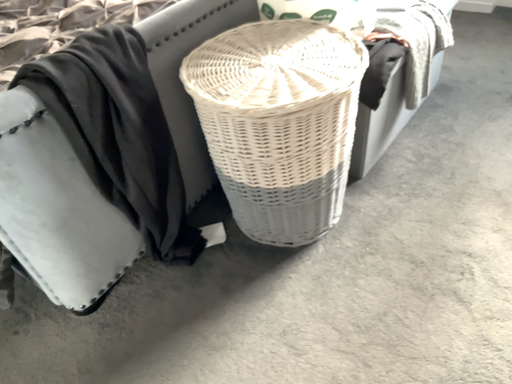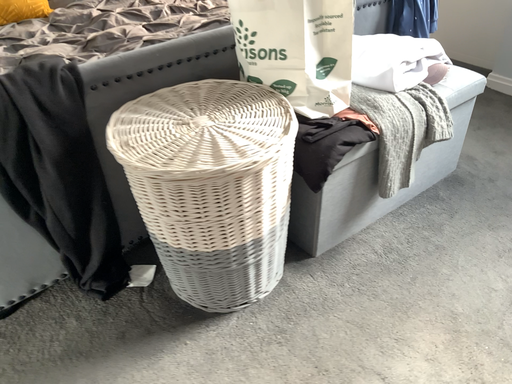
Question: Which way did the camera rotate in the video?

Choices:
 (A) rotated right
 (B) rotated left

Answer: (B)